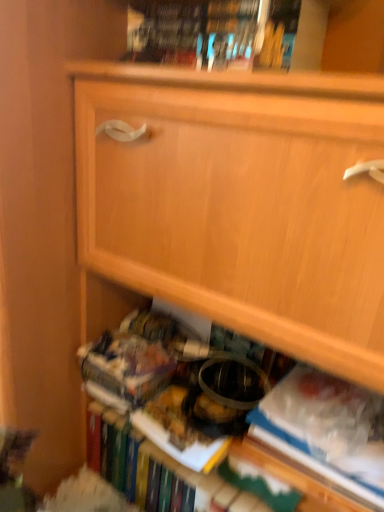
Question: Does white paper at lower right have a greater width compared to hardcover book at upper center?

Choices:
 (A) no
 (B) yes

Answer: (A)

Question: Considering the relative sizes of white paper at lower right and hardcover book at upper center in the image provided, is white paper at lower right shorter than hardcover book at upper center?

Choices:
 (A) no
 (B) yes

Answer: (A)

Question: Is white paper at lower right completely or partially outside of hardcover book at upper center?

Choices:
 (A) no
 (B) yes

Answer: (B)

Question: Does white paper at lower right have a smaller size compared to hardcover book at upper center?

Choices:
 (A) yes
 (B) no

Answer: (A)

Question: Is white paper at lower right turned away from hardcover book at upper center?

Choices:
 (A) yes
 (B) no

Answer: (B)

Question: Considering the relative sizes of white paper at lower right and hardcover book at upper center in the image provided, is white paper at lower right thinner than hardcover book at upper center?

Choices:
 (A) no
 (B) yes

Answer: (B)

Question: Can you confirm if hardcover book at upper center is bigger than white paper at lower right?

Choices:
 (A) yes
 (B) no

Answer: (A)

Question: From a real-world perspective, is hardcover book at upper center physically above white paper at lower right?

Choices:
 (A) no
 (B) yes

Answer: (B)

Question: Does hardcover book at upper center have a greater width compared to white paper at lower right?

Choices:
 (A) no
 (B) yes

Answer: (B)

Question: Is hardcover book at upper center shorter than white paper at lower right?

Choices:
 (A) no
 (B) yes

Answer: (B)

Question: Does hardcover book at upper center contain white paper at lower right?

Choices:
 (A) no
 (B) yes

Answer: (A)

Question: Is the position of hardcover book at upper center more distant than that of white paper at lower right?

Choices:
 (A) yes
 (B) no

Answer: (B)

Question: From a real-world perspective, relative to white paper at lower right, is hardcover book at upper center vertically above or below?

Choices:
 (A) below
 (B) above

Answer: (B)